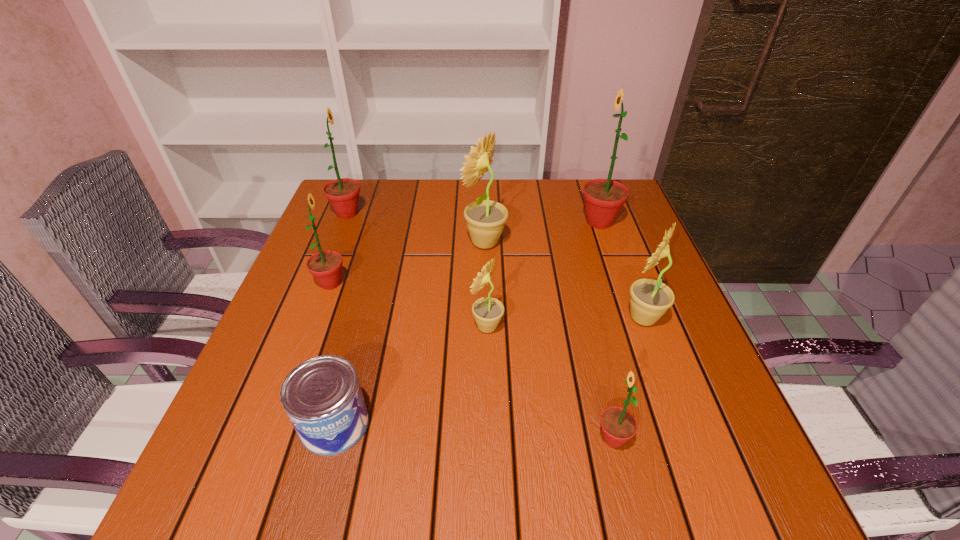
This screenshot has width=960, height=540. I want to click on the rightmost green sunflower, so click(603, 198).

You are a GUI agent. You are given a task and a screenshot of the screen. Output one action in this format:
    pyautogui.click(x=<x>, y=<y>)
    Task: Click on the tallest sunflower
    This screenshot has width=960, height=540.
    Given the screenshot: What is the action you would take?
    pyautogui.click(x=603, y=198)

Locate an element on the screen. This screenshot has width=960, height=540. the biggest yellow sunflower is located at coordinates (486, 219).

At what (x,y) coordinates should I click in order to perform the action: click on the second biggest green sunflower. Please return your answer as a coordinate pair (x, y). Looking at the image, I should click on (342, 193).

Where is `the rightmost yellow sunflower`? The height and width of the screenshot is (540, 960). the rightmost yellow sunflower is located at coordinates 650,299.

Locate an element on the screen. Image resolution: width=960 pixels, height=540 pixels. the fourth farthest sunflower is located at coordinates (326, 266).

Locate an element on the screen. the second smallest green sunflower is located at coordinates [326, 266].

Image resolution: width=960 pixels, height=540 pixels. Find the location of `the smallest yellow sunflower`. the smallest yellow sunflower is located at coordinates (487, 311).

The width and height of the screenshot is (960, 540). Identify the location of the nearest sunflower. (618, 425).

Image resolution: width=960 pixels, height=540 pixels. I want to click on the smallest green sunflower, so click(618, 425).